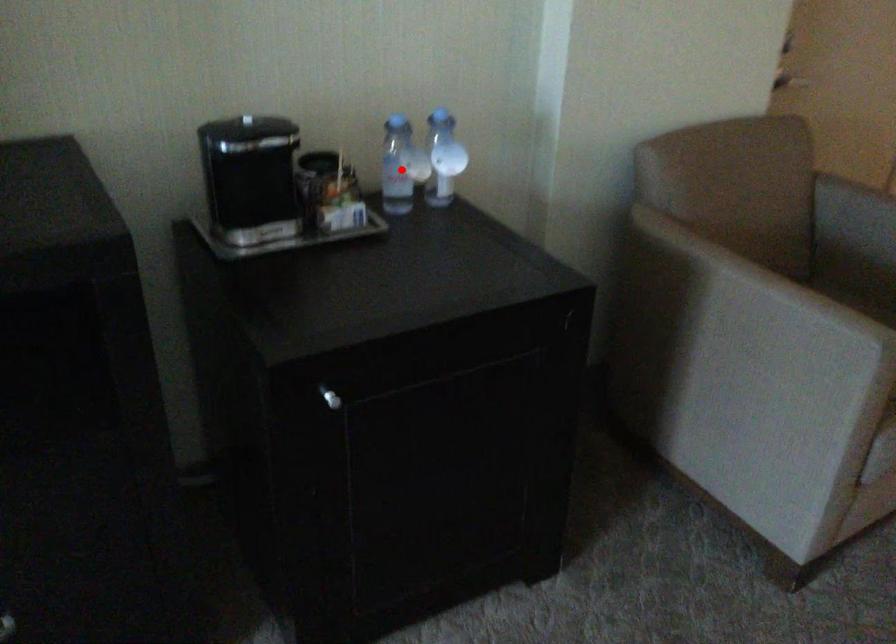
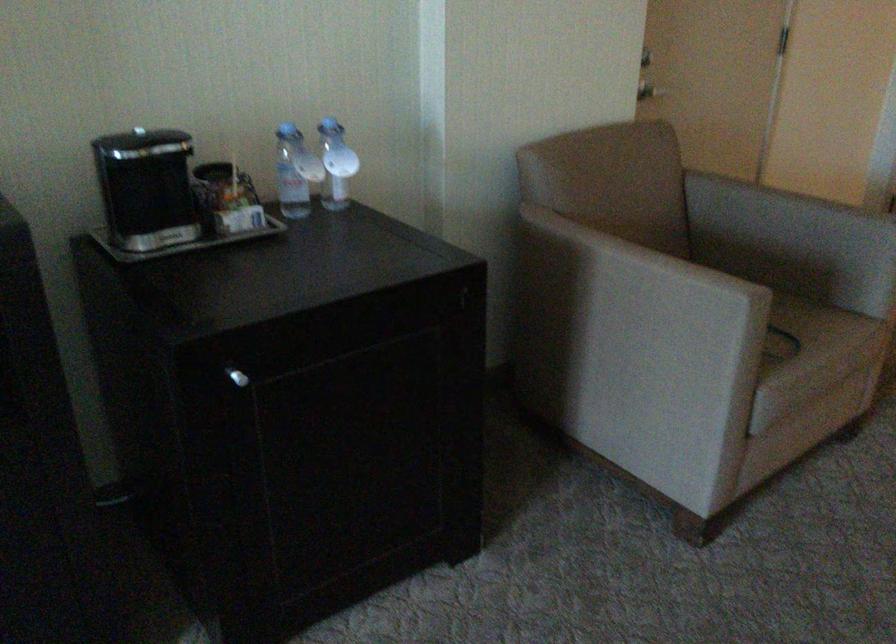
The point at the highlighted location is marked in the first image. Where is the corresponding point in the second image?

(295, 172)